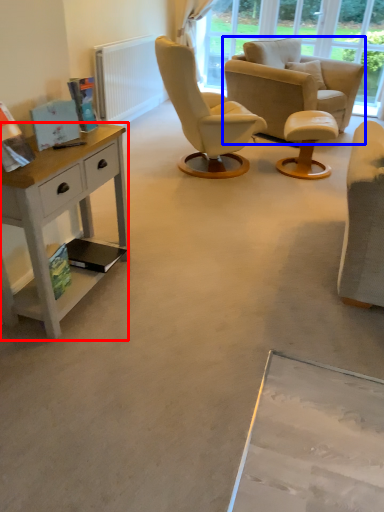
Question: Among these objects, which one is farthest to the camera, desk (highlighted by a red box) or chair (highlighted by a blue box)?

Choices:
 (A) desk
 (B) chair

Answer: (B)